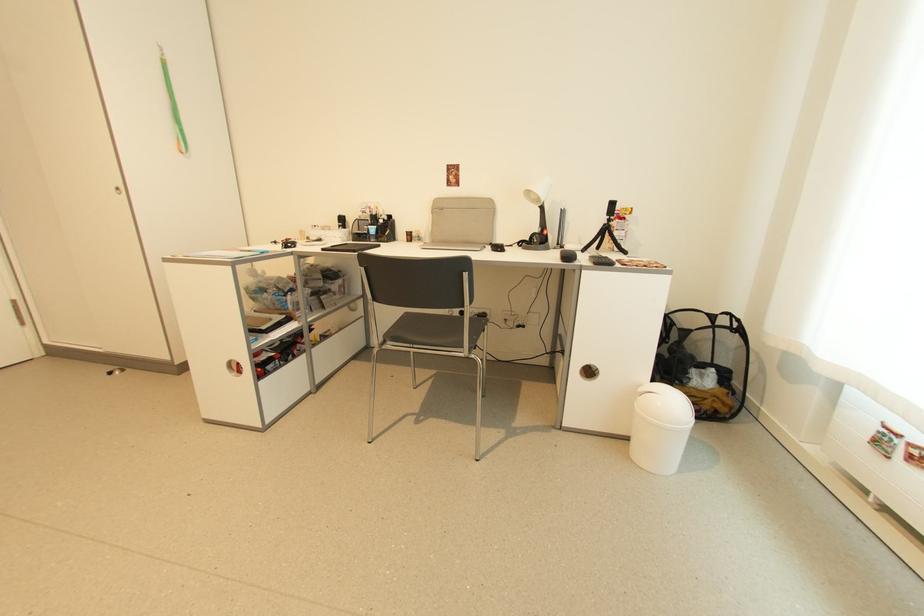
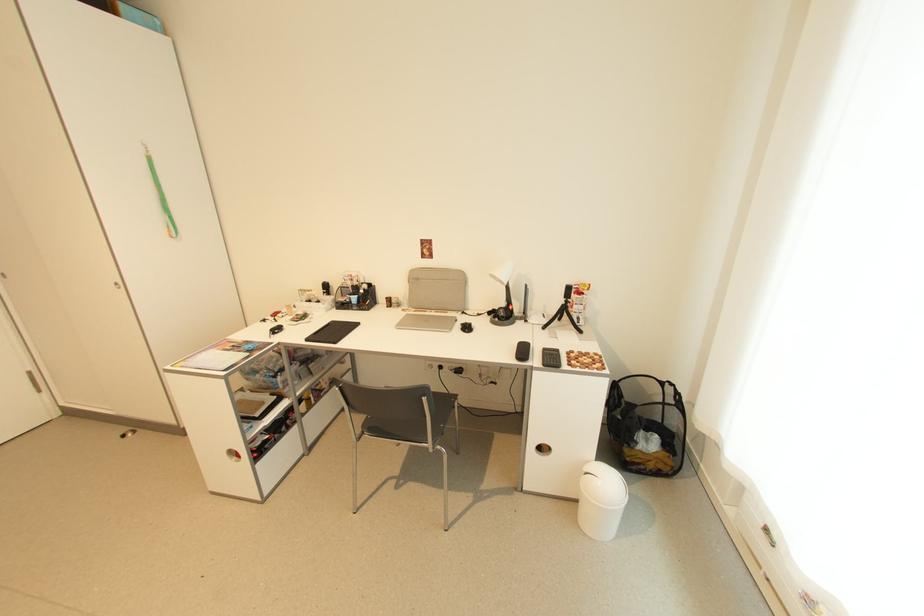
The point at (236, 374) is marked in the first image. Where is the corresponding point in the second image?

(237, 460)